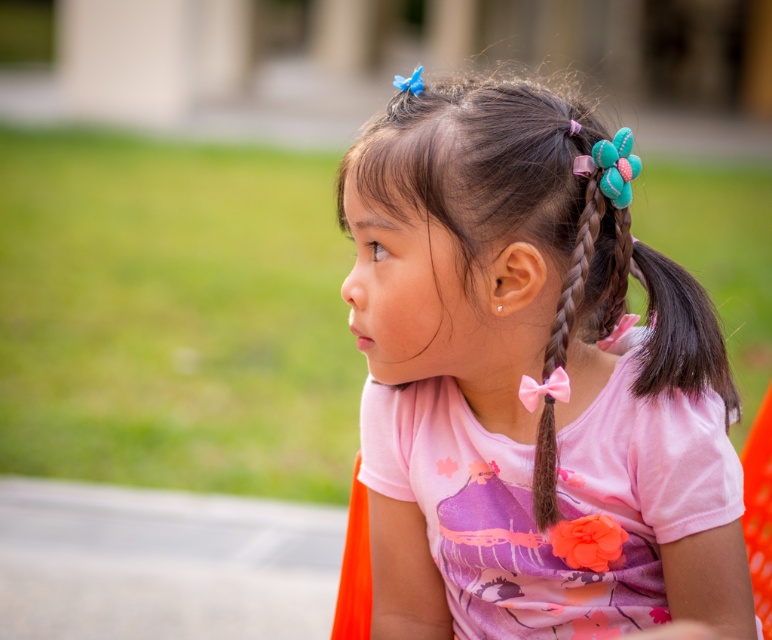
Who is higher up, pink fabric shirt at center or pink satin ribbon at right?

pink satin ribbon at right is above.

This screenshot has height=640, width=772. Identify the location of pink fabric shirt at center. (530, 385).

I want to click on pink fabric shirt at center, so click(x=530, y=385).